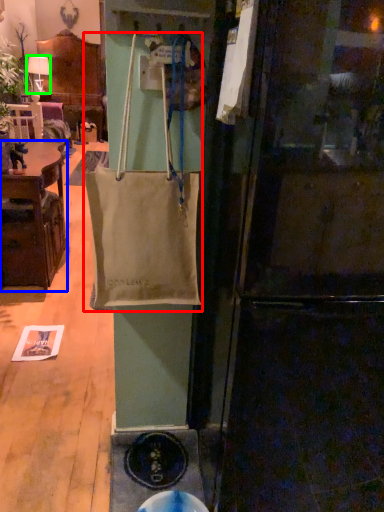
Question: Which is nearer to the handbag (highlighted by a red box)? cabinetry (highlighted by a blue box) or lamp (highlighted by a green box).

Choices:
 (A) cabinetry
 (B) lamp

Answer: (A)